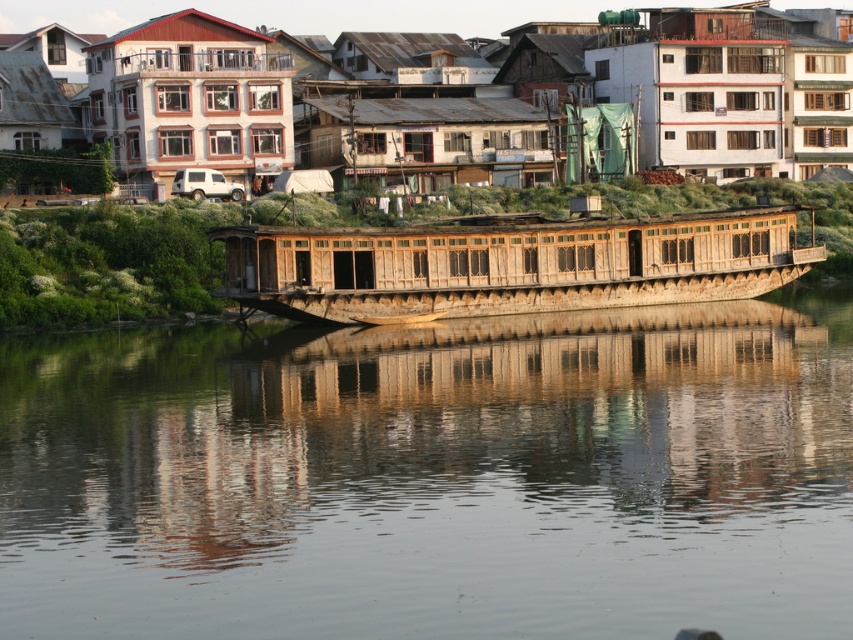
The width and height of the screenshot is (853, 640). Find the location of `smooth brown water at center`. smooth brown water at center is located at coordinates (434, 477).

Does smooth brown water at center have a smaller size compared to wooden houseboat at center?

No, smooth brown water at center is not smaller than wooden houseboat at center.

Who is more distant from viewer, (596,496) or (737,234)?

The point (737,234) is behind.

Where is `smooth brown water at center`? The image size is (853, 640). smooth brown water at center is located at coordinates (434, 477).